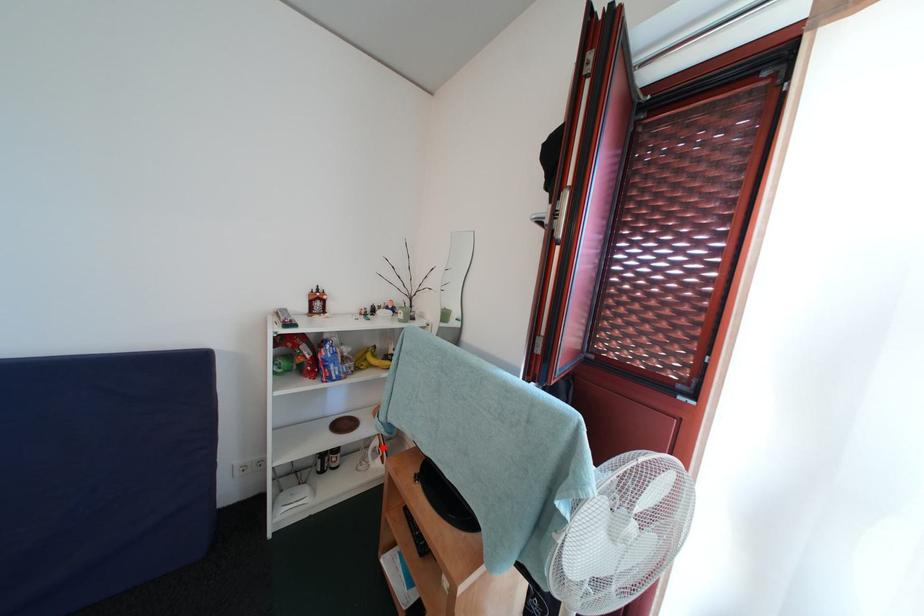
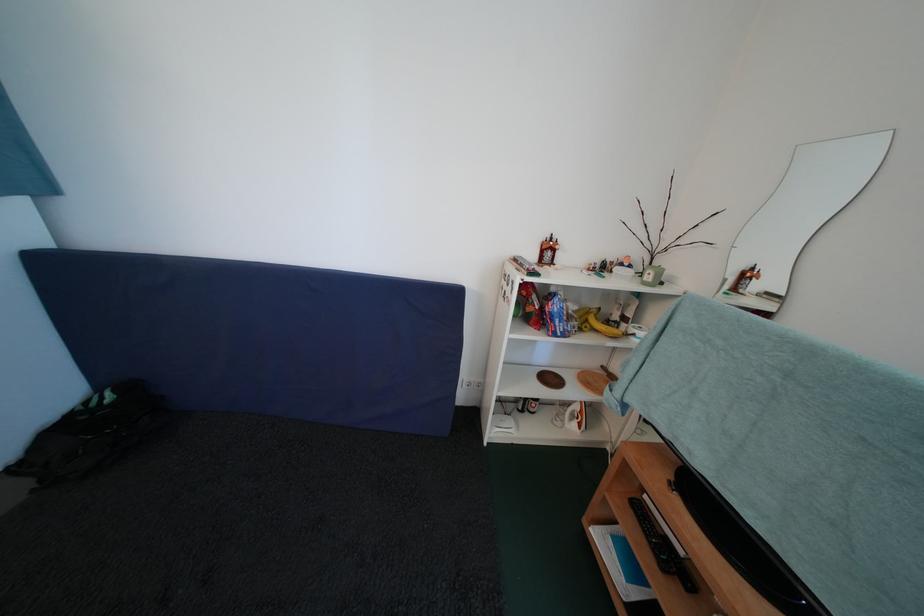
Question: A red point is marked in image1. In image2, is the corresponding 3D point closer to the camera or farther? Reply with the corresponding letter.

Choices:
 (A) The corresponding 3D point is closer.
 (B) The corresponding 3D point is farther.

Answer: (A)